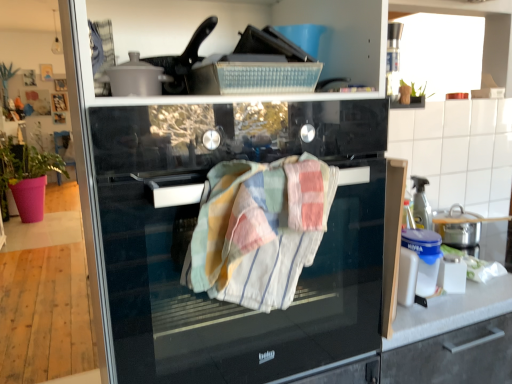
Question: Is black glass oven at center far from multicolored woven towel at center?

Choices:
 (A) no
 (B) yes

Answer: (A)

Question: Can we say black glass oven at center lies outside multicolored woven towel at center?

Choices:
 (A) no
 (B) yes

Answer: (B)

Question: Is black glass oven at center at the right side of multicolored woven towel at center?

Choices:
 (A) yes
 (B) no

Answer: (B)

Question: Is black glass oven at center taller than multicolored woven towel at center?

Choices:
 (A) no
 (B) yes

Answer: (B)

Question: Would you say black glass oven at center contains multicolored woven towel at center?

Choices:
 (A) yes
 (B) no

Answer: (A)

Question: Is black glass oven at center wider or thinner than pink fabric plant at left?

Choices:
 (A) thin
 (B) wide

Answer: (A)

Question: Is black glass oven at center in front of or behind pink fabric plant at left in the image?

Choices:
 (A) behind
 (B) front

Answer: (B)

Question: From a real-world perspective, is black glass oven at center positioned above or below pink fabric plant at left?

Choices:
 (A) above
 (B) below

Answer: (A)

Question: Does point (108, 142) appear closer or farther from the camera than point (44, 175)?

Choices:
 (A) closer
 (B) farther

Answer: (A)

Question: Looking at the image, does multicolored woven towel at center seem bigger or smaller compared to pink fabric plant at left?

Choices:
 (A) big
 (B) small

Answer: (B)

Question: From the image's perspective, relative to pink fabric plant at left, is multicolored woven towel at center above or below?

Choices:
 (A) above
 (B) below

Answer: (B)

Question: In the image, is multicolored woven towel at center on the left side or the right side of pink fabric plant at left?

Choices:
 (A) left
 (B) right

Answer: (B)

Question: Is multicolored woven towel at center inside or outside of pink fabric plant at left?

Choices:
 (A) inside
 (B) outside

Answer: (B)

Question: Considering the positions of point (47, 170) and point (276, 286), is point (47, 170) closer or farther from the camera than point (276, 286)?

Choices:
 (A) farther
 (B) closer

Answer: (A)

Question: Which is correct: pink fabric plant at left is inside multicolored woven towel at center, or outside of it?

Choices:
 (A) outside
 (B) inside

Answer: (A)